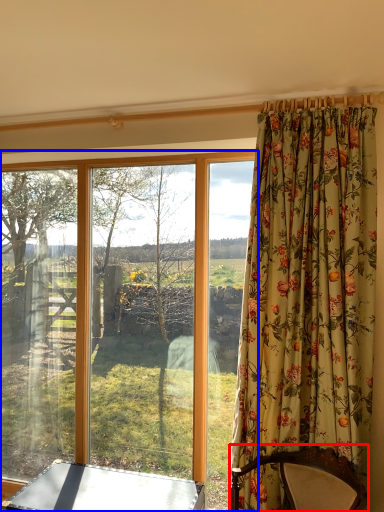
Question: Which object appears farthest to the camera in this image, furniture (highlighted by a red box) or window (highlighted by a blue box)?

Choices:
 (A) furniture
 (B) window

Answer: (B)